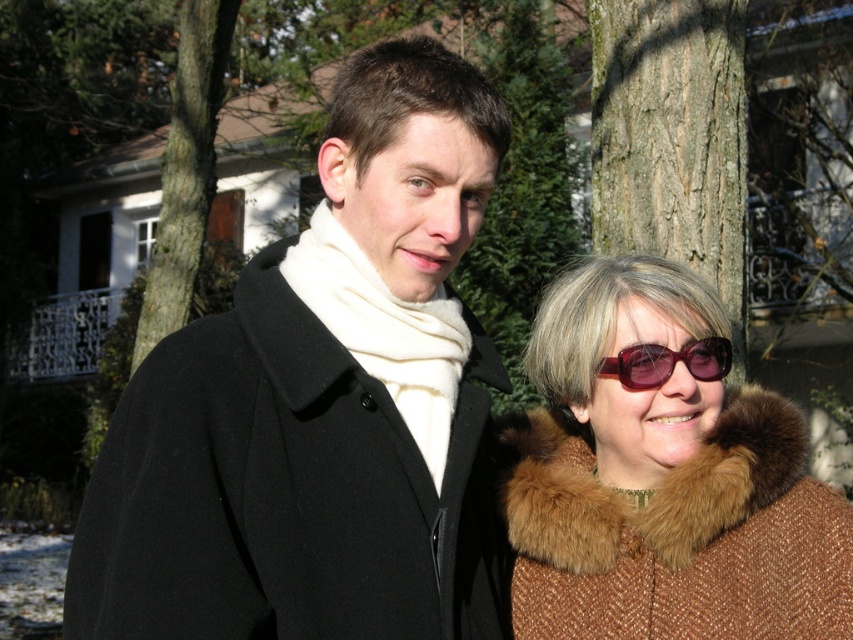
In the scene shown: Is brown woolen coat at center positioned at the back of burgundy plastic sunglasses at right?

No.

Is brown woolen coat at center thinner than burgundy plastic sunglasses at right?

Incorrect, brown woolen coat at center's width is not less than burgundy plastic sunglasses at right's.

Between point (618, 540) and point (599, 372), which one is positioned in front?

Positioned in front is point (599, 372).

Locate an element on the screen. brown woolen coat at center is located at coordinates (660, 476).

Who is shorter, black wool coat at center or brown textured bark at upper left?

black wool coat at center is shorter.

Between point (456, 609) and point (204, 160), which one is positioned in front?

Positioned in front is point (456, 609).

Locate an element on the screen. The width and height of the screenshot is (853, 640). black wool coat at center is located at coordinates (317, 406).

Which is in front, point (433, 433) or point (703, 253)?

Point (433, 433)

Which is more to the left, black wool coat at center or smooth bark tree at upper center?

black wool coat at center

Does point (157, 496) come closer to viewer compared to point (602, 214)?

Yes, point (157, 496) is closer to viewer.

Image resolution: width=853 pixels, height=640 pixels. What are the coordinates of `black wool coat at center` in the screenshot? It's located at (317, 406).